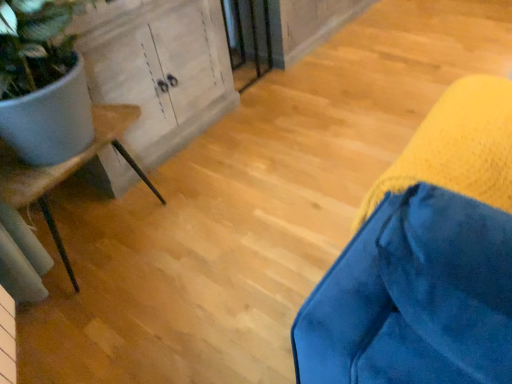
Question: Based on their positions, is velvet blue cushion at lower right, the 2th furniture in the back-to-front sequence, located to the left or right of white matte plant pot at left, which is the second furniture from front to back?

Choices:
 (A) left
 (B) right

Answer: (B)

Question: Looking at their shapes, would you say velvet blue cushion at lower right, placed as the 1th furniture when sorted from front to back, is wider or thinner than white matte plant pot at left, which is the second furniture from front to back?

Choices:
 (A) thin
 (B) wide

Answer: (A)

Question: Based on their relative distances, which object is farther from the wooden cabinet at left?

Choices:
 (A) white matte plant pot at left, the 1th furniture in the back-to-front sequence
 (B) velvet blue cushion at lower right, which is the second furniture from left to right
 (C) wooden screen door at center

Answer: (B)

Question: Considering the real-world distances, which object is farthest from the wooden screen door at center?

Choices:
 (A) velvet blue cushion at lower right, which is the 1th furniture from right to left
 (B) wooden cabinet at left
 (C) white matte plant pot at left, which is the second furniture from front to back

Answer: (A)